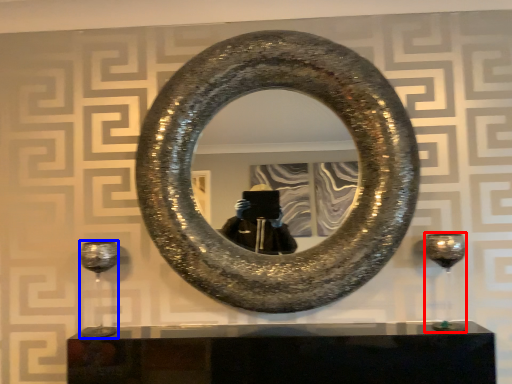
Question: Which of the following is the closest to the observer, wine glass (highlighted by a red box) or wine glass (highlighted by a blue box)?

Choices:
 (A) wine glass
 (B) wine glass

Answer: (A)